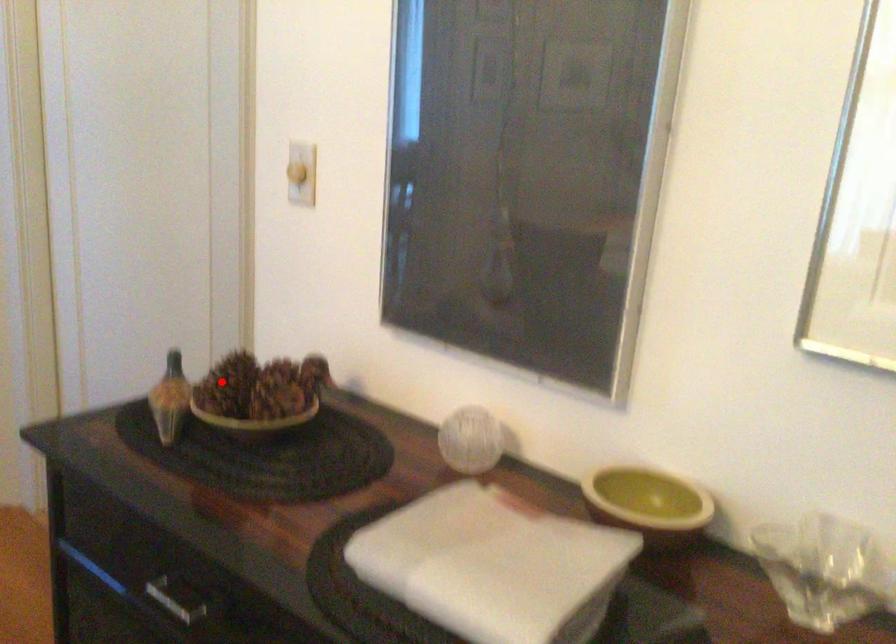
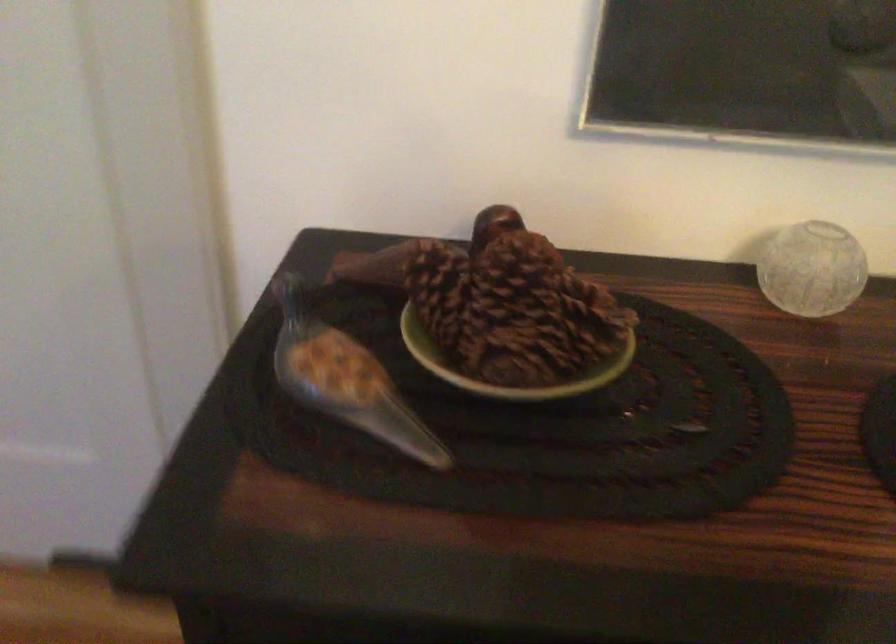
Where in the second image is the point corresponding to the highlighted location from the first image?

(440, 292)